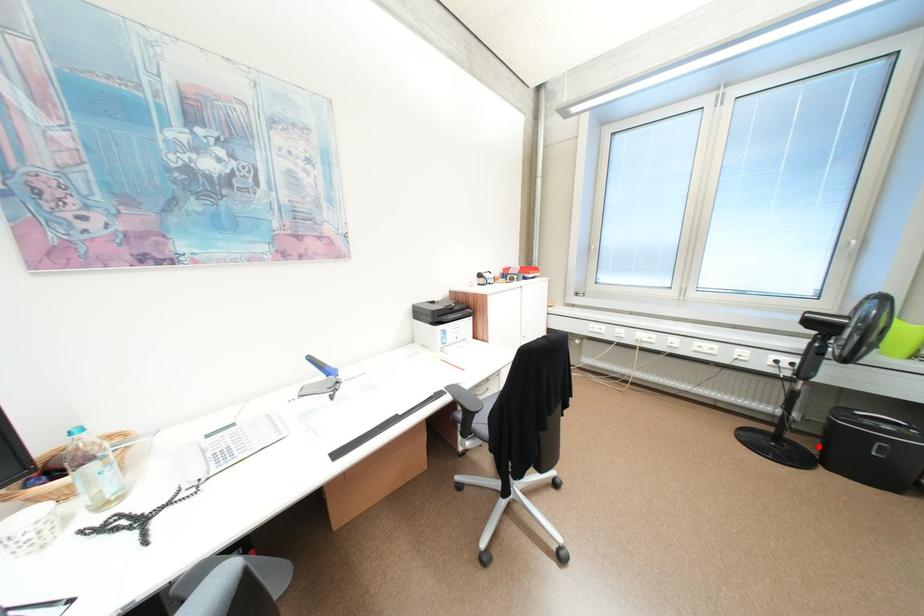
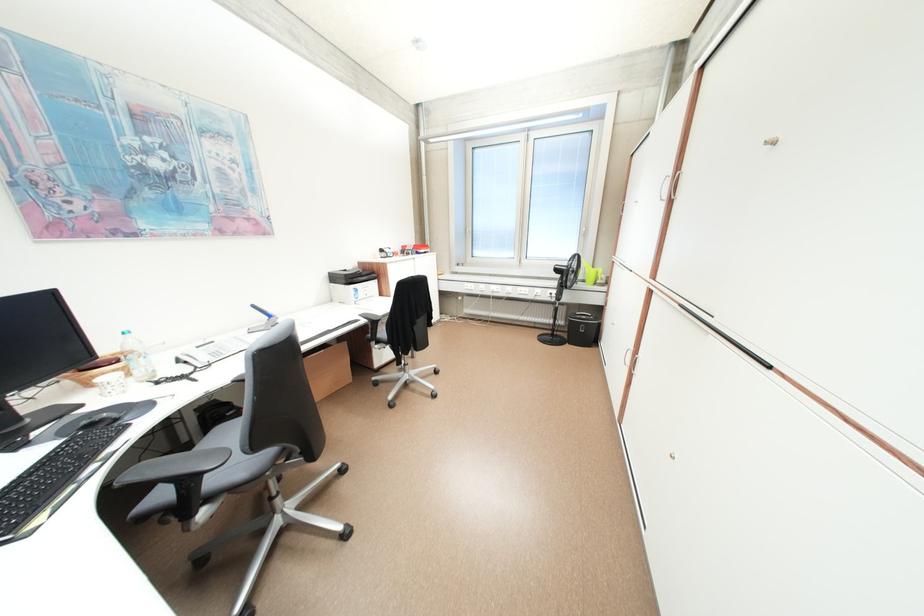
Locate, in the second image, the point that corresponds to the highlighted location in the first image.

(576, 337)